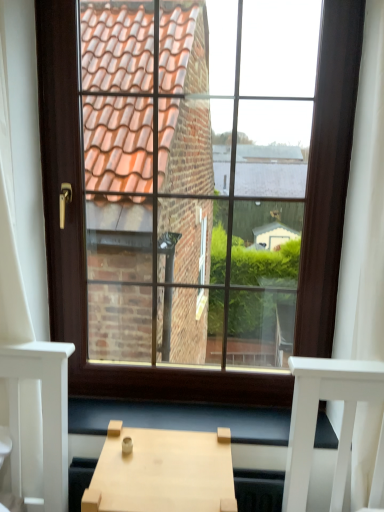
Identify the location of wooden at lower center. The height and width of the screenshot is (512, 384). (181, 419).

At what (x,y) coordinates should I click in order to perform the action: click on brown wooden window at center. Please return your answer as a coordinate pair (x, y). Looking at the image, I should click on (84, 248).

Can you tell me how much brown wooden window at center and wooden at lower center differ in facing direction?

The angle between the facing direction of brown wooden window at center and the facing direction of wooden at lower center is 0.911 degrees.

Is brown wooden window at center closer to the viewer compared to wooden at lower center?

Yes, it is in front of wooden at lower center.

From the image's perspective, which one is positioned lower, brown wooden window at center or wooden at lower center?

From the image's view, wooden at lower center is below.

Is brown wooden window at center aimed at wooden at lower center?

Yes, brown wooden window at center faces towards wooden at lower center.

In the image, is wooden at lower center on the left side or the right side of brown wooden window at center?

Clearly, wooden at lower center is on the right of brown wooden window at center in the image.

Can brown wooden window at center be found inside wooden at lower center?

No, wooden at lower center does not contain brown wooden window at center.

Looking at this image, which of these two, wooden at lower center or brown wooden window at center, is smaller?

Smaller between the two is wooden at lower center.

Locate an element on the screen. window located on the left of wooden at lower center is located at coordinates (84, 248).

Is wooden at lower center positioned with its back to light wood table at center?

That's right, wooden at lower center is facing away from light wood table at center.

Which of these two, wooden at lower center or light wood table at center, stands taller?

Standing taller between the two is light wood table at center.

Can you tell me how much wooden at lower center and light wood table at center differ in facing direction?

The angle between the facing direction of wooden at lower center and the facing direction of light wood table at center is 1.03 degrees.

Between wooden at lower center and light wood table at center, which one has larger width?

Wider between the two is light wood table at center.

Which object is further away from the camera taking this photo, light wood table at center or brown wooden window at center?

brown wooden window at center is further from the camera.

Considering the positions of points (100, 467) and (78, 341), is point (100, 467) farther from camera compared to point (78, 341)?

No.

Looking at this image, who is smaller, light wood table at center or brown wooden window at center?

Smaller between the two is light wood table at center.

Is brown wooden window at center completely or partially inside light wood table at center?

Actually, brown wooden window at center is outside light wood table at center.

Consider the image. Considering the relative sizes of brown wooden window at center and light wood table at center in the image provided, is brown wooden window at center shorter than light wood table at center?

Incorrect, the height of brown wooden window at center does not fall short of that of light wood table at center.

Considering the relative sizes of brown wooden window at center and light wood table at center in the image provided, is brown wooden window at center wider than light wood table at center?

Incorrect, the width of brown wooden window at center does not surpass that of light wood table at center.

Which is nearer, (311,330) or (156,435)?

Positioned in front is point (156,435).

Is light wood table at center turned away from wooden at lower center?

Yes, wooden at lower center is at the back of light wood table at center.

Considering the sizes of objects light wood table at center and wooden at lower center in the image provided, who is wider, light wood table at center or wooden at lower center?

Wider between the two is light wood table at center.

Is light wood table at center directly adjacent to wooden at lower center?

No, light wood table at center is not beside wooden at lower center.

Does light wood table at center contain wooden at lower center?

Definitely not — wooden at lower center is not inside light wood table at center.

Identify the location of window that appears above the wooden at lower center (from a real-world perspective). (84, 248).

Where is `window lying in front of the wooden at lower center`? The height and width of the screenshot is (512, 384). window lying in front of the wooden at lower center is located at coordinates (84, 248).

Looking at the image, which one is located further to light wood table at center, brown wooden window at center or wooden at lower center?

The object further to light wood table at center is brown wooden window at center.

Based on the photo, based on their spatial positions, is wooden at lower center or brown wooden window at center further from light wood table at center?

brown wooden window at center is positioned further to the anchor light wood table at center.

When comparing their distances from wooden at lower center, does brown wooden window at center or light wood table at center seem closer?

Based on the image, brown wooden window at center appears to be nearer to wooden at lower center.

Based on their spatial positions, is light wood table at center or wooden at lower center further from brown wooden window at center?

The object further to brown wooden window at center is light wood table at center.

Estimate the real-world distances between objects in this image. Which object is further from brown wooden window at center, wooden at lower center or light wood table at center?

Based on the image, light wood table at center appears to be further to brown wooden window at center.

Considering their positions, is light wood table at center positioned further to wooden at lower center than brown wooden window at center?

light wood table at center.

Where is `window sill between brown wooden window at center and light wood table at center in the vertical direction`? This screenshot has width=384, height=512. window sill between brown wooden window at center and light wood table at center in the vertical direction is located at coordinates (181, 419).